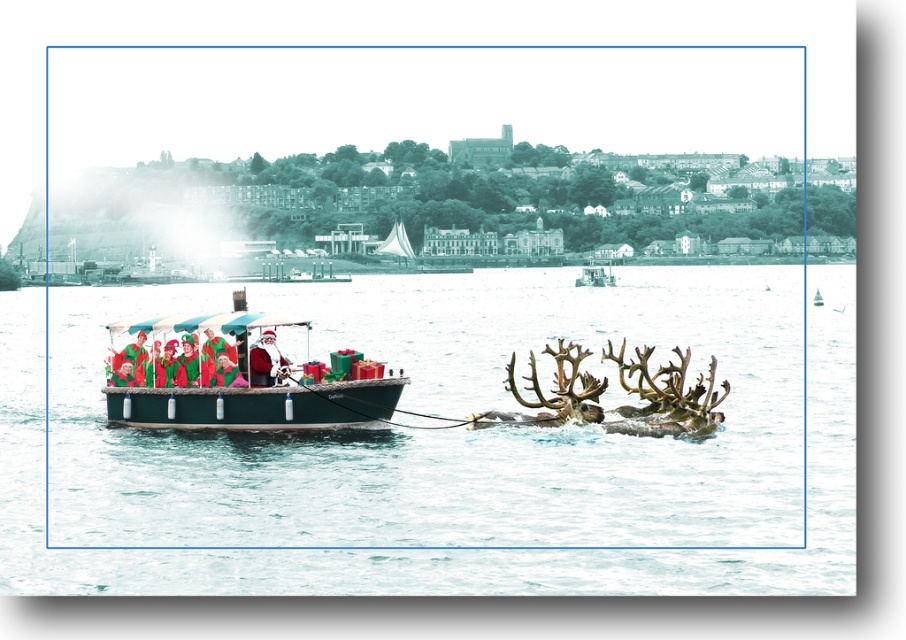
Between clear water at boat center and metallic green boat at center, which one has more height?

clear water at boat center is taller.

Is clear water at boat center to the right of metallic green boat at center from the viewer's perspective?

In fact, clear water at boat center is to the left of metallic green boat at center.

Which is in front, point (429, 504) or point (583, 268)?

Positioned in front is point (429, 504).

Find the location of a particular element. Image resolution: width=906 pixels, height=640 pixels. clear water at boat center is located at coordinates (445, 445).

Describe the element at coordinates (445, 445) in the screenshot. I see `clear water at boat center` at that location.

Is clear water at boat center in front of green matte boat at center?

Yes, clear water at boat center is closer to the viewer.

The width and height of the screenshot is (906, 640). Identify the location of clear water at boat center. (445, 445).

The image size is (906, 640). Find the location of `clear water at boat center`. clear water at boat center is located at coordinates (445, 445).

Can you confirm if green matte boat at center is positioned above metallic green boat at center?

No, green matte boat at center is not above metallic green boat at center.

Who is higher up, green matte boat at center or metallic green boat at center?

metallic green boat at center

Who is more forward, [238,381] or [605,282]?

Positioned in front is point [238,381].

The width and height of the screenshot is (906, 640). Find the location of `green matte boat at center`. green matte boat at center is located at coordinates pyautogui.click(x=239, y=378).